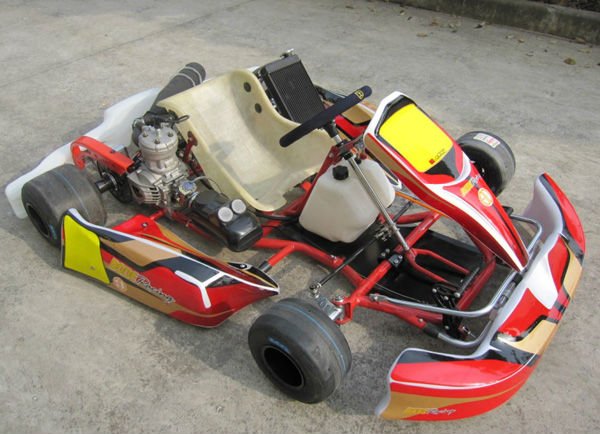
You are a GUI agent. You are given a task and a screenshot of the screen. Output one action in this format:
    pyautogui.click(x=<x>, y=<y>)
    Task: Click on the seat
    The width and height of the screenshot is (600, 434).
    Given the screenshot: What is the action you would take?
    tap(229, 165)